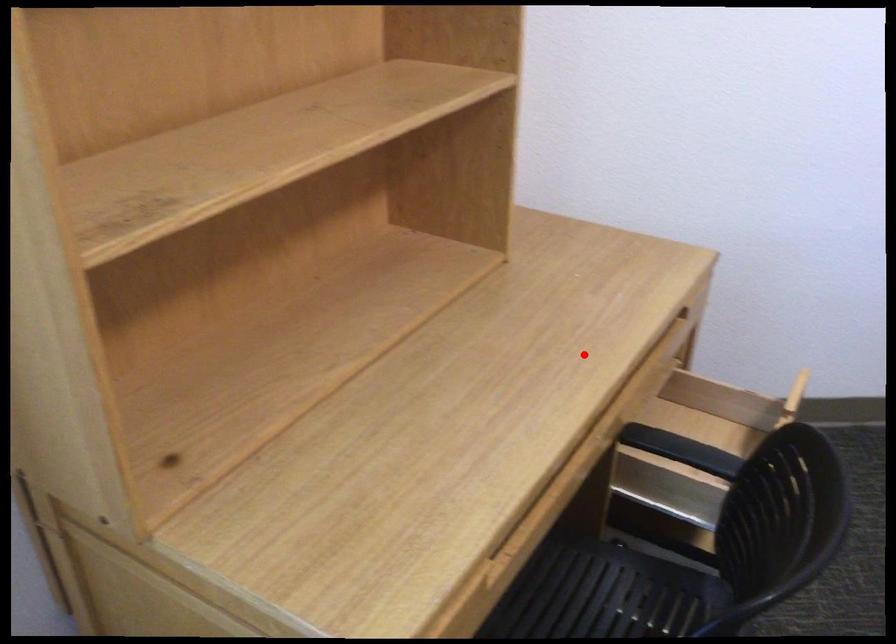
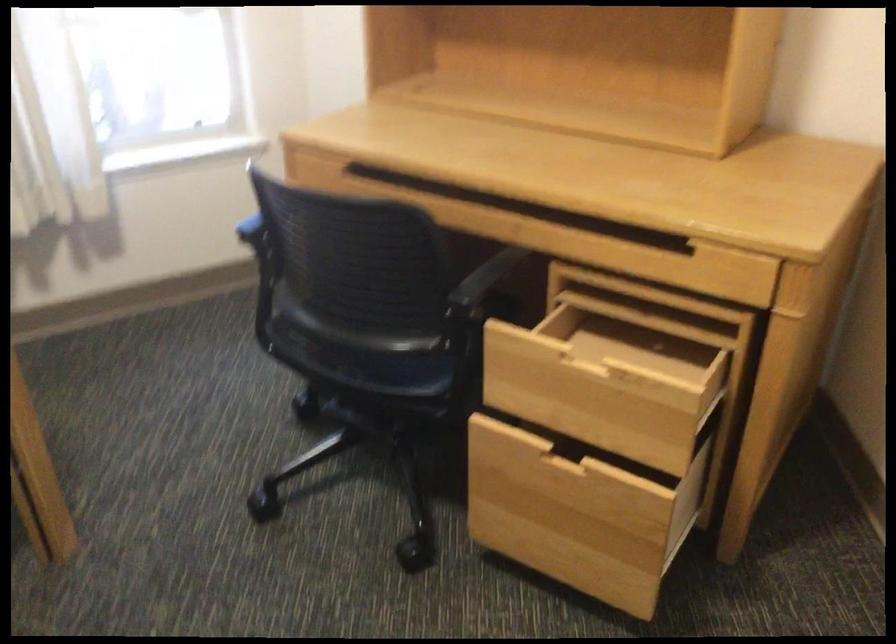
Find the pixel in the second image that matches the highlighted location in the first image.

(668, 240)